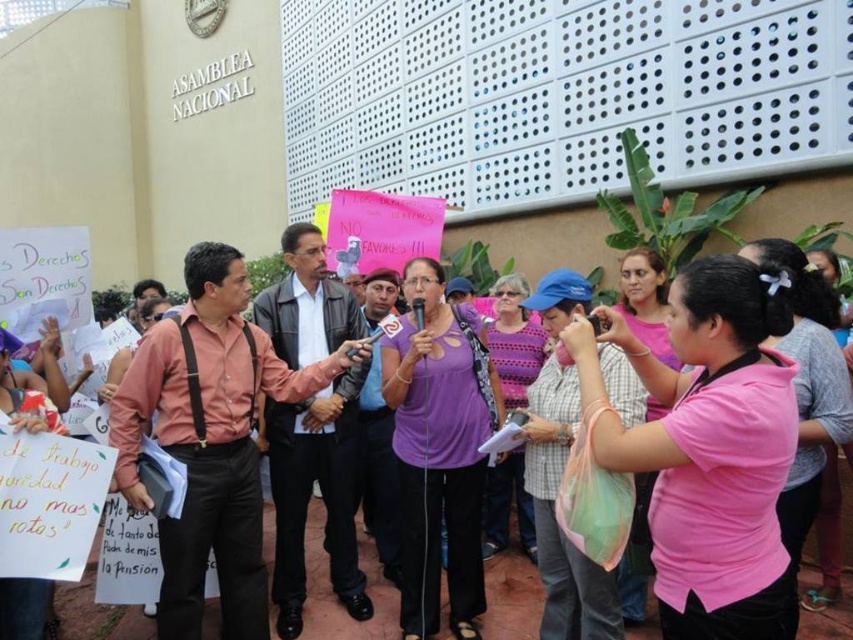
Does matte pink shirt at center have a greater height compared to purple fabric shirt at center?

Yes, matte pink shirt at center is taller than purple fabric shirt at center.

Between point (113, 394) and point (523, 573), which one is positioned behind?

Point (523, 573)

Where is `matte pink shirt at center`? matte pink shirt at center is located at coordinates (210, 440).

The width and height of the screenshot is (853, 640). Identify the location of matte pink shirt at center. (210, 440).

Does dark brown leather jacket at center have a greater height compared to purple fabric shirt at center?

Correct, dark brown leather jacket at center is much taller as purple fabric shirt at center.

Is dark brown leather jacket at center wider than purple fabric shirt at center?

Incorrect, dark brown leather jacket at center's width does not surpass purple fabric shirt at center's.

Is point (341, 554) positioned in front of point (317, 556)?

Yes, it is in front of point (317, 556).

At what (x,y) coordinates should I click in order to perform the action: click on dark brown leather jacket at center. Please return your answer as a coordinate pair (x, y). The image size is (853, 640). Looking at the image, I should click on (310, 493).

Does matte pink shirt at center have a lesser height compared to dark brown leather jacket at center?

Correct, matte pink shirt at center is not as tall as dark brown leather jacket at center.

Can you confirm if matte pink shirt at center is positioned to the right of dark brown leather jacket at center?

Incorrect, matte pink shirt at center is not on the right side of dark brown leather jacket at center.

Locate an element on the screen. This screenshot has height=640, width=853. matte pink shirt at center is located at coordinates (210, 440).

The height and width of the screenshot is (640, 853). In order to click on matte pink shirt at center in this screenshot , I will do pyautogui.click(x=210, y=440).